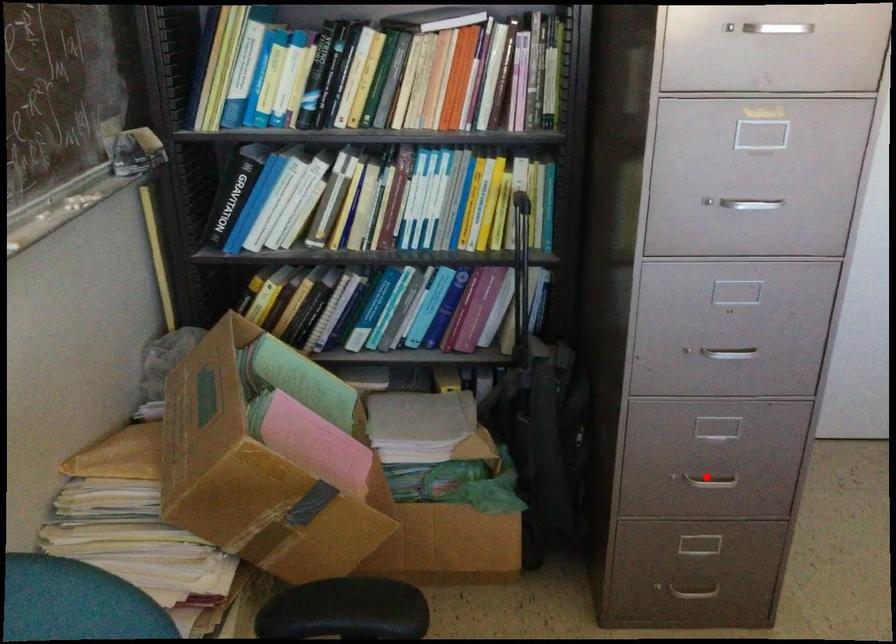
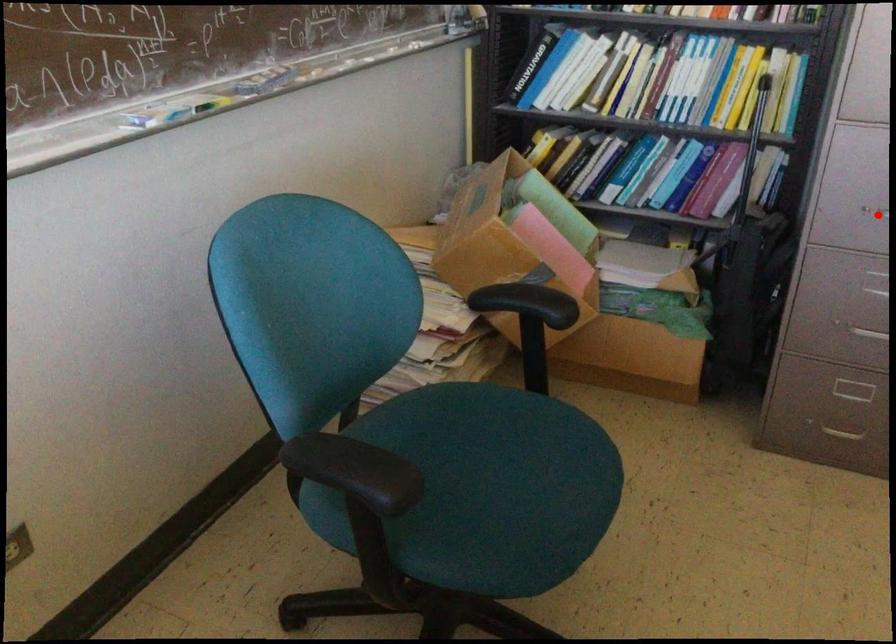
I am providing you with two images of the same scene from different viewpoints. A red point is marked on the first image and another point is marked on the second image. Is the red point in image1 aligned with the point shown in image2?

No